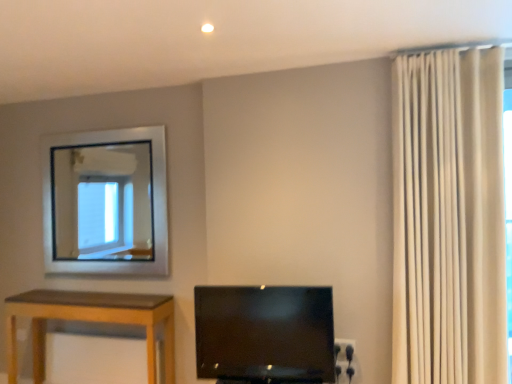
Question: Considering the positions of white textured curtain at right and matte black tv at center in the image, is white textured curtain at right bigger or smaller than matte black tv at center?

Choices:
 (A) small
 (B) big

Answer: (B)

Question: From a real-world perspective, is white textured curtain at right physically located above or below matte black tv at center?

Choices:
 (A) above
 (B) below

Answer: (A)

Question: Considering the positions of white textured curtain at right and matte black tv at center in the image, is white textured curtain at right wider or thinner than matte black tv at center?

Choices:
 (A) thin
 (B) wide

Answer: (B)

Question: From a real-world perspective, is matte black tv at center above or below white textured curtain at right?

Choices:
 (A) above
 (B) below

Answer: (B)

Question: Considering the positions of matte black tv at center and white textured curtain at right in the image, is matte black tv at center wider or thinner than white textured curtain at right?

Choices:
 (A) wide
 (B) thin

Answer: (B)

Question: Is matte black tv at center to the left or to the right of white textured curtain at right in the image?

Choices:
 (A) left
 (B) right

Answer: (A)

Question: Is point (297, 379) positioned closer to the camera than point (484, 359)?

Choices:
 (A) farther
 (B) closer

Answer: (A)